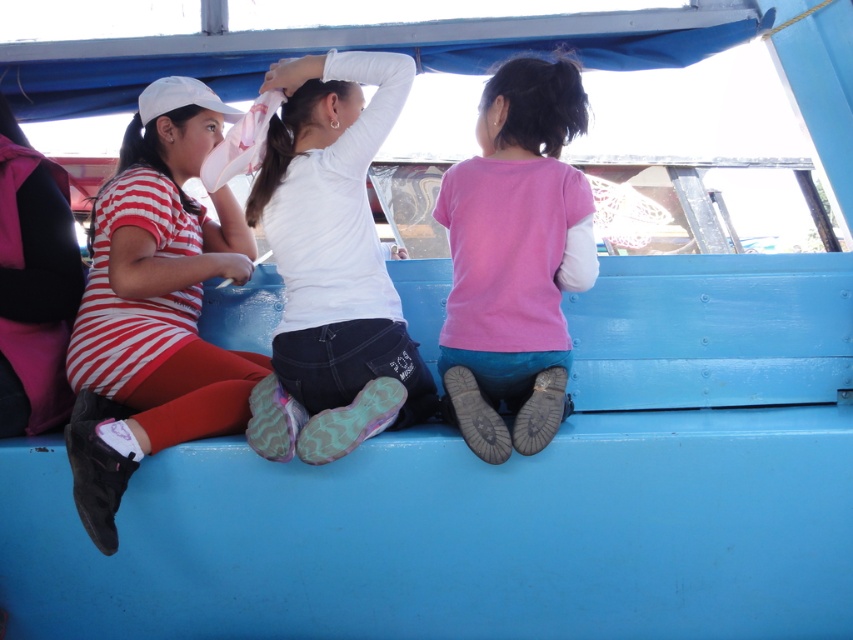
Who is higher up, white matte shirt at center or pink matte shirt at center?

Positioned higher is pink matte shirt at center.

Who is positioned more to the right, white matte shirt at center or pink matte shirt at center?

pink matte shirt at center

Measure the distance between point (363, 356) and camera.

Point (363, 356) is 7.14 feet away from camera.

Locate an element on the screen. white matte shirt at center is located at coordinates (331, 266).

Who is positioned more to the left, striped fabric dress at left or white matte shirt at center?

striped fabric dress at left

Is striped fabric dress at left bigger than white matte shirt at center?

Yes, striped fabric dress at left is bigger than white matte shirt at center.

What are the coordinates of `striped fabric dress at left` in the screenshot? It's located at (155, 304).

Can you confirm if striped fabric dress at left is taller than pink matte shirt at center?

Yes, striped fabric dress at left is taller than pink matte shirt at center.

Can you confirm if striped fabric dress at left is positioned below pink matte shirt at center?

Yes.

The image size is (853, 640). I want to click on striped fabric dress at left, so click(155, 304).

Locate an element on the screen. The image size is (853, 640). striped fabric dress at left is located at coordinates (155, 304).